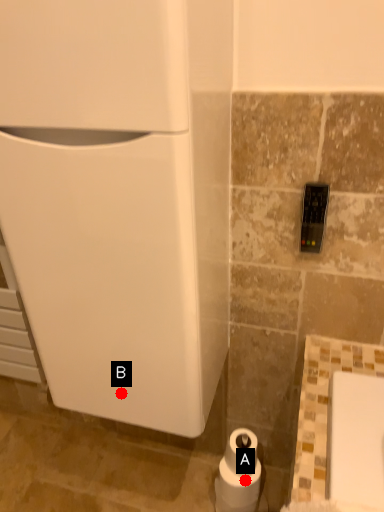
Question: Two points are circled on the image, labeled by A and B beside each circle. Which point is farther to the camera?

Choices:
 (A) A is further
 (B) B is further

Answer: (A)